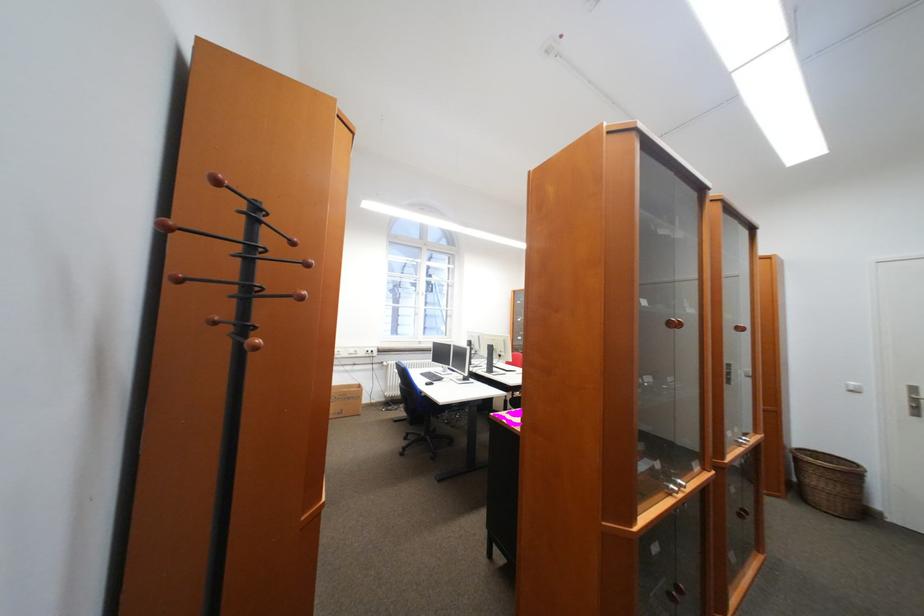
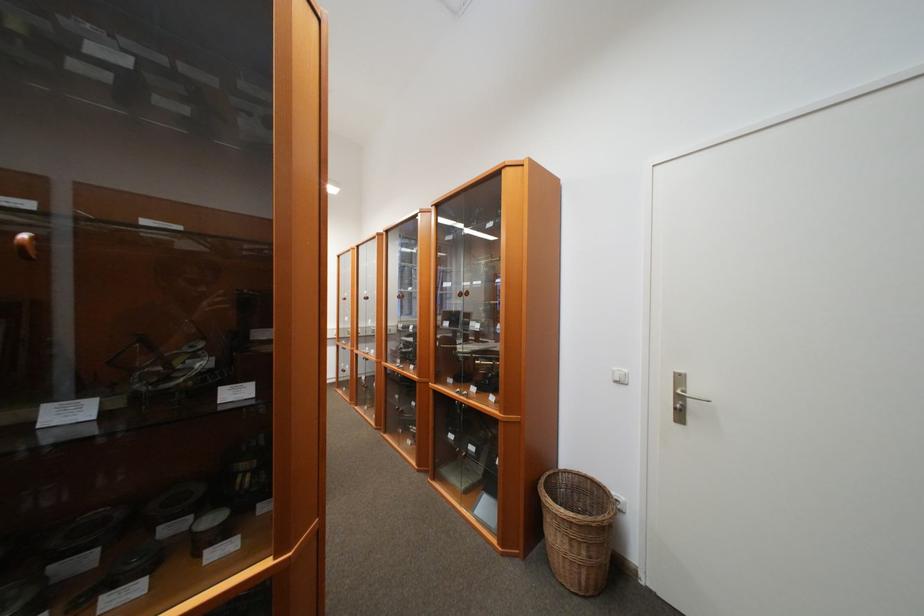
The point at (x=860, y=392) is marked in the first image. Where is the corresponding point in the second image?

(626, 383)